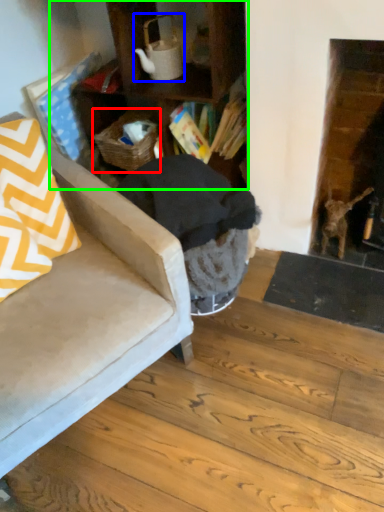
Question: Considering the real-world distances, which object is farthest from basket (highlighted by a red box)? tea pot (highlighted by a blue box) or cabinetry (highlighted by a green box)?

Choices:
 (A) tea pot
 (B) cabinetry

Answer: (A)